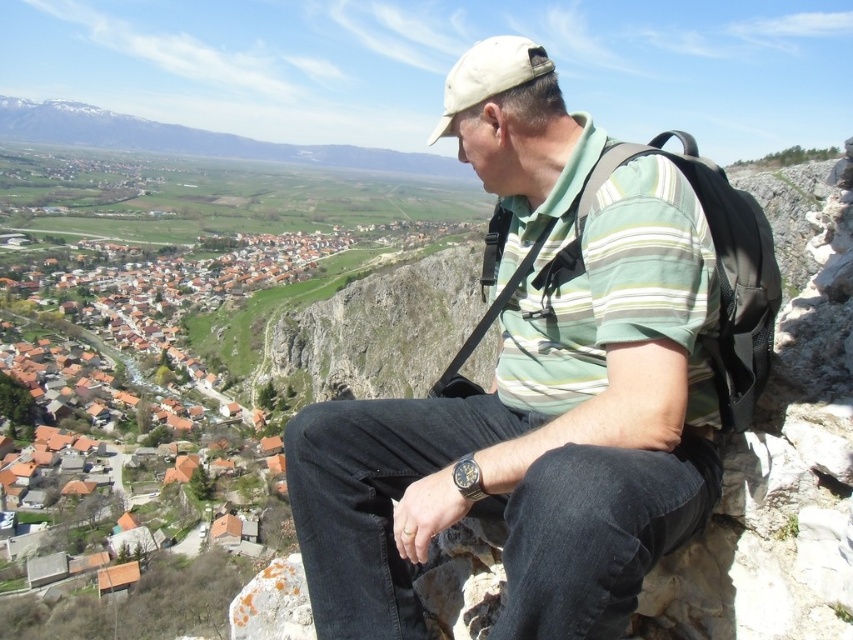
You are a hiker who wants to check the weather using your phone. You remember that your phone is in the pocket of your matte green striped shirt at center. However, your hands are currently holding onto the black fabric backpack at center for balance. Can you easily access the phone without letting go of the backpack?

The matte green striped shirt at center is located below the black fabric backpack at center, so you can access the phone in the shirt pocket without letting go of the backpack since the shirt is positioned lower and within reach.